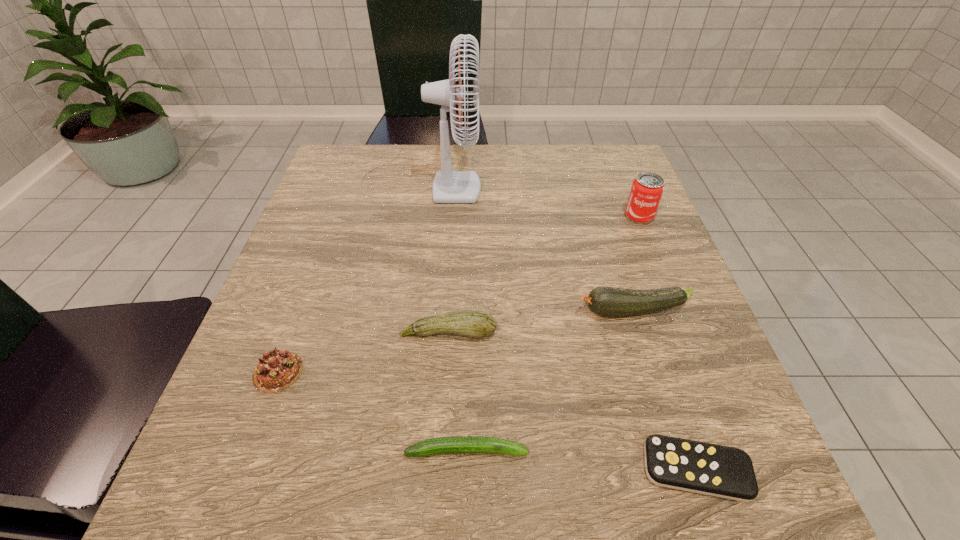
Image resolution: width=960 pixels, height=540 pixels. I want to click on fan that is positioned at the left edge, so click(449, 186).

Find the location of a particular element. The width and height of the screenshot is (960, 540). chocolate cake that is at the left edge is located at coordinates (277, 370).

Identify the location of can at the right edge. The height and width of the screenshot is (540, 960). (647, 189).

The image size is (960, 540). I want to click on zucchini that is at the right edge, so click(x=606, y=301).

Where is `remote control at the right edge`? This screenshot has width=960, height=540. remote control at the right edge is located at coordinates (716, 470).

Identify the location of object at the far left corner. (449, 186).

You are a GUI agent. You are given a task and a screenshot of the screen. Output one action in this format:
    pyautogui.click(x=<x>, y=<y>)
    Task: Click on the object present at the near right corner
    
    Given the screenshot: What is the action you would take?
    pyautogui.click(x=716, y=470)

Image resolution: width=960 pixels, height=540 pixels. In the image, there is a desktop. Identify the location of vacant space at the far edge. (475, 164).

Find the location of a particular element. The width and height of the screenshot is (960, 540). vacant area at the near edge is located at coordinates (314, 461).

I want to click on vacant space at the left edge, so click(x=329, y=201).